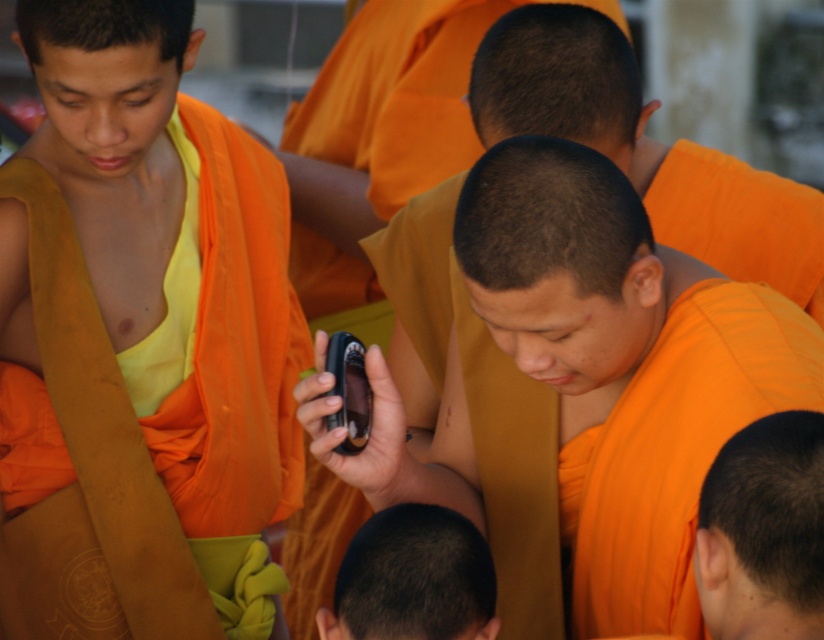
You are a photographer who wants to capture a clear photo of the matte orange monk at center and the dark brown hair at center. The camera has a depth of field that can focus on objects within 10 inches of each other. Can both subjects be in focus at the same time?

The matte orange monk at center is 11.63 inches away from dark brown hair at center. Since the distance between them is greater than 10 inches, they cannot both be in focus at the same time.

You are a photographer who wants to capture a photo of the matte orange robe at left and the shiny orange monk at center. Since the background is blurred, which object should you focus on to ensure both are in sharp focus?

The matte orange robe at left is much taller than the shiny orange monk at center, so focusing on the shiny orange monk at center would ensure both are in sharp focus because it is closer to the camera.

You are a photographer trying to capture a photo of the shiny orange monk at center and the matte orange robe at left. Since the background is blurred, which object should you focus on to ensure both are in focus?

To ensure both the matte orange robe at left and the shiny orange monk at center are in focus, focus on the shiny orange monk at center since it is closer to the camera than the matte orange robe at left.